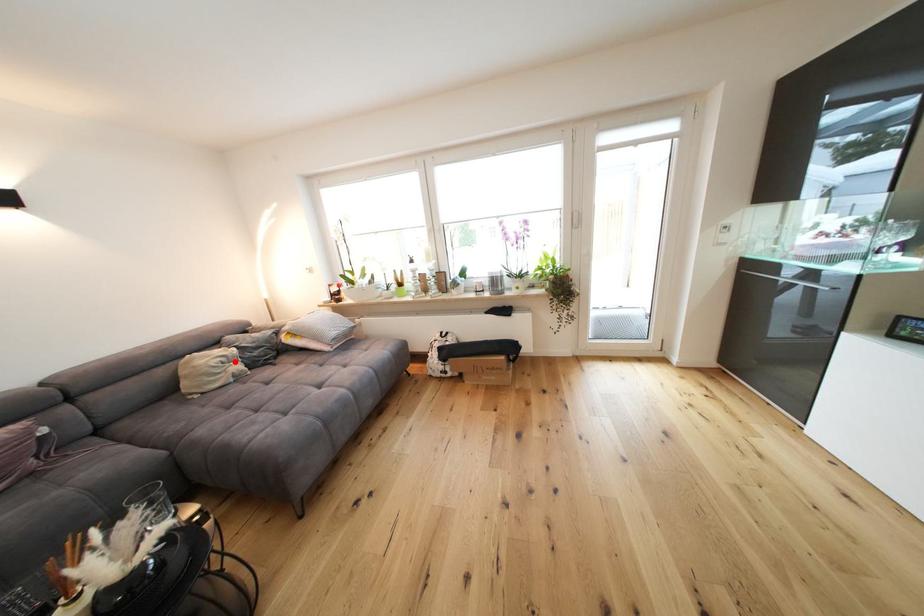
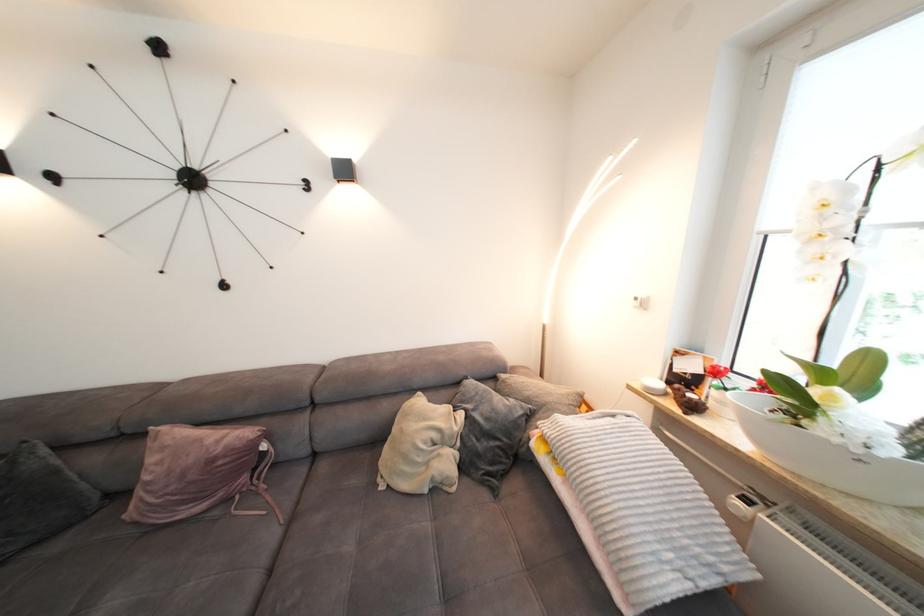
Question: I am providing you with two images of the same scene from different viewpoints. Given a red point in image1, look at the same physical point in image2. Is it:

Choices:
 (A) Closer to the viewpoint
 (B) Farther from the viewpoint

Answer: (B)